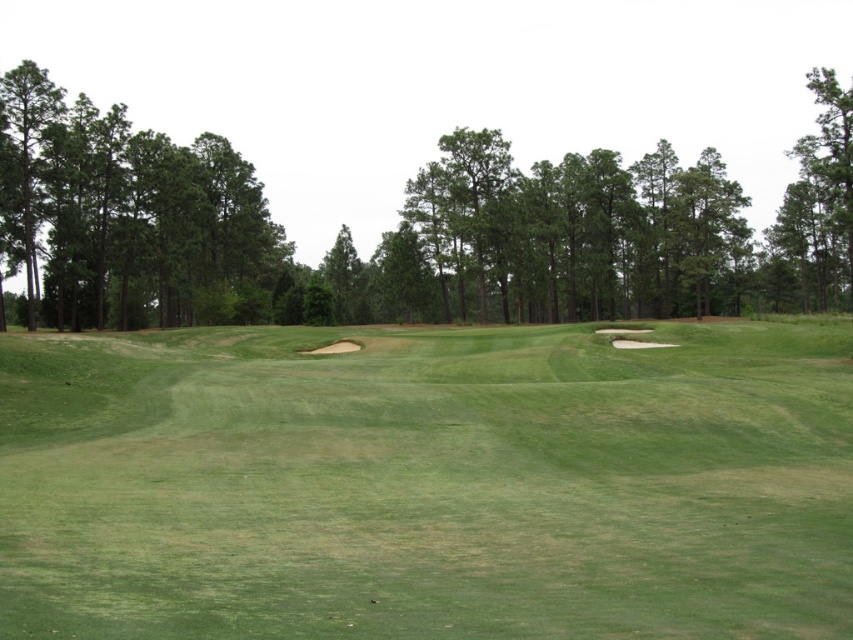
You are a golfer standing on the fairway and notice two groups of green leafy trees at center and green leafy trees at left. Which group of trees is wider in terms of their spread?

The green leafy trees at center are wider in terms of their spread than the green leafy trees at left.

You are a golfer standing on the tee, facing the green grassy fairway at center and the green leafy trees at left. You want to hit the ball to the center of the fairway. Which direction should you aim to avoid hitting the trees?

You should aim to the right of the green grassy fairway at center because the green grassy fairway at center is wider than the green leafy trees at left, so there is more space to the right to avoid the trees.

You are standing at the tee box on the golf course and want to hit your ball to a specific point. The point you need to reach is labeled as point (640, 621). If your golf ball travels in a straight line towards this point, how far will it have to travel?

The distance of point (640, 621) from the camera is 8.16 meters, so the golf ball will have to travel 8.16 meters to reach the point.